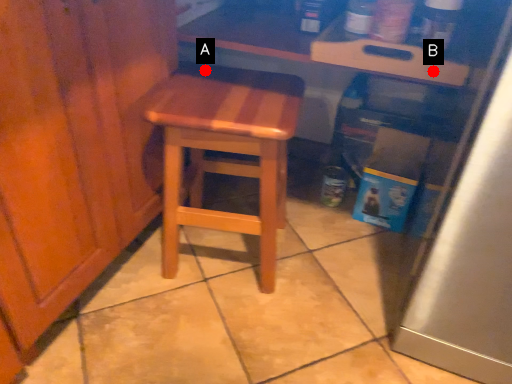
Question: Two points are circled on the image, labeled by A and B beside each circle. Among these points, which one is nearest to the camera?

Choices:
 (A) A is closer
 (B) B is closer

Answer: (B)